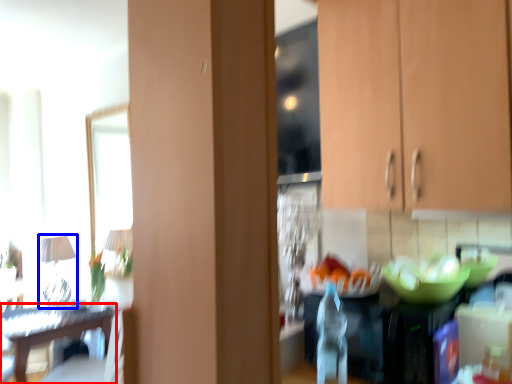
Question: Which point is further to the camera, table (highlighted by a red box) or lamp (highlighted by a blue box)?

Choices:
 (A) table
 (B) lamp

Answer: (B)